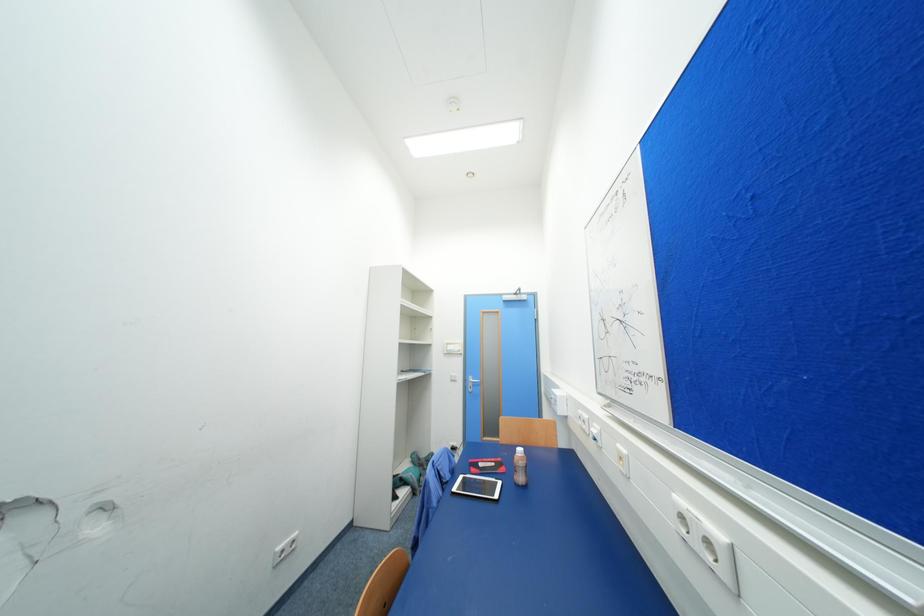
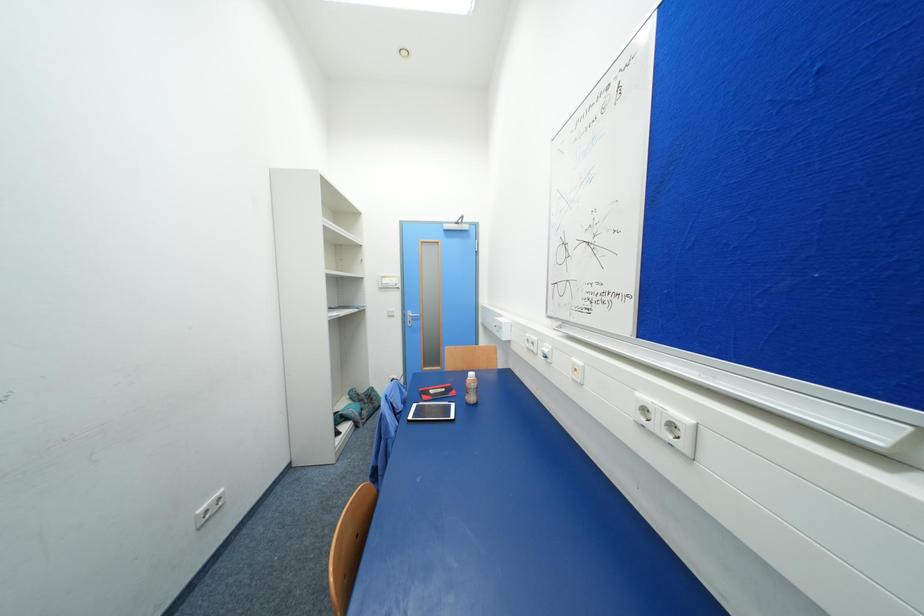
What movement of the cameraman would produce the second image?

The cameraman walked toward left, forward.